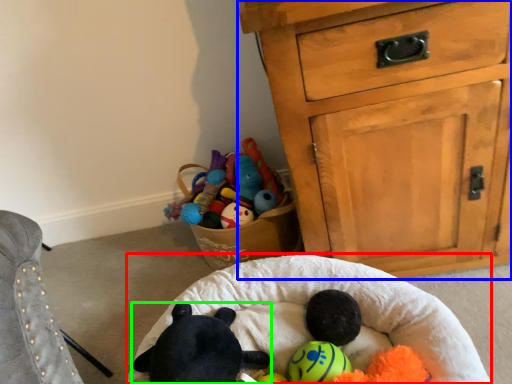
Question: Based on their relative distances, which object is nearer to infant bed (highlighted by a red box)? Choose from chest of drawers (highlighted by a blue box) and toy (highlighted by a green box).

Choices:
 (A) chest of drawers
 (B) toy

Answer: (B)